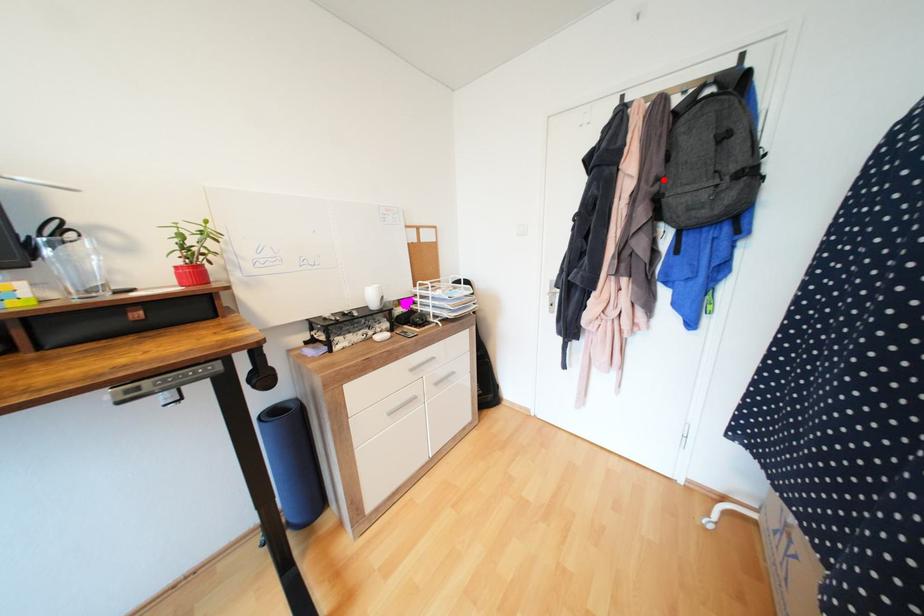
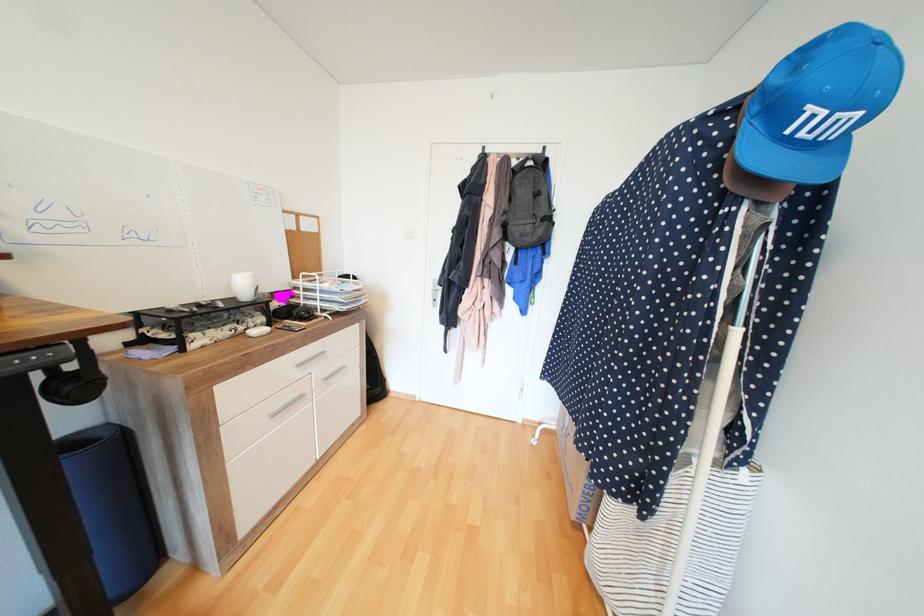
In the second image, find the point that corresponds to the highlighted location in the first image.

(511, 213)